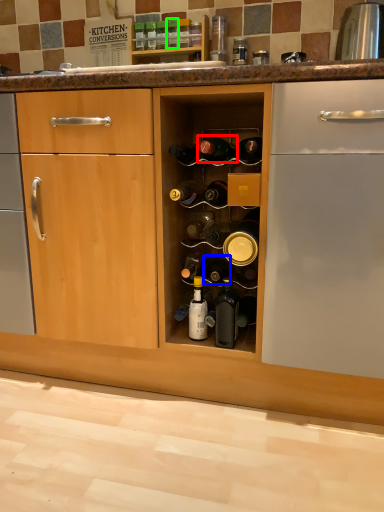
Question: Which object is positioned farthest from beer bottle (highlighted by a red box)? Select from bottle (highlighted by a blue box) and bottle (highlighted by a green box).

Choices:
 (A) bottle
 (B) bottle

Answer: (B)